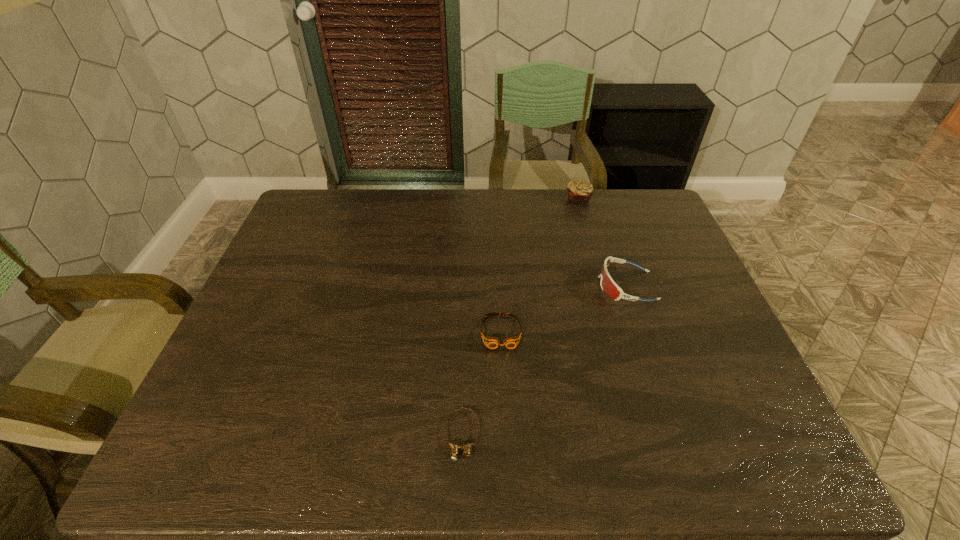
You are a GUI agent. You are given a task and a screenshot of the screen. Output one action in this format:
    pyautogui.click(x=<x>, y=<y>)
    Task: Click on the unoccupied position between the farthest goggles and the farthest object
    Image resolution: width=960 pixels, height=540 pixels.
    Given the screenshot: What is the action you would take?
    pyautogui.click(x=602, y=242)

Where is `object that is the second closest to the muffin`? The width and height of the screenshot is (960, 540). object that is the second closest to the muffin is located at coordinates (491, 342).

Identify the location of object that stands as the second closest to the second shortest object. (610, 288).

Locate which goggles ranks second in proximity to the muffin. Please provide its 2D coordinates. Your answer should be formatted as a tuple, i.e. [(x, y)], where the tuple contains the x and y coordinates of a point satisfying the conditions above.

[(491, 342)]

Identify which goggles is located as the second nearest to the leftmost goggles. Please provide its 2D coordinates. Your answer should be formatted as a tuple, i.e. [(x, y)], where the tuple contains the x and y coordinates of a point satisfying the conditions above.

[(610, 288)]

Where is `free spot that satisfies the following two spatial constraints: 1. on the front-facing side of the farthest goggles; 2. on the front lenses and sides of the leftmost goggles`? The height and width of the screenshot is (540, 960). free spot that satisfies the following two spatial constraints: 1. on the front-facing side of the farthest goggles; 2. on the front lenses and sides of the leftmost goggles is located at coordinates (677, 436).

Find the location of `vacant space that satisfies the following two spatial constraints: 1. on the front-facing side of the tallest goggles; 2. on the front lenses and sides of the nearest goggles`. vacant space that satisfies the following two spatial constraints: 1. on the front-facing side of the tallest goggles; 2. on the front lenses and sides of the nearest goggles is located at coordinates (677, 436).